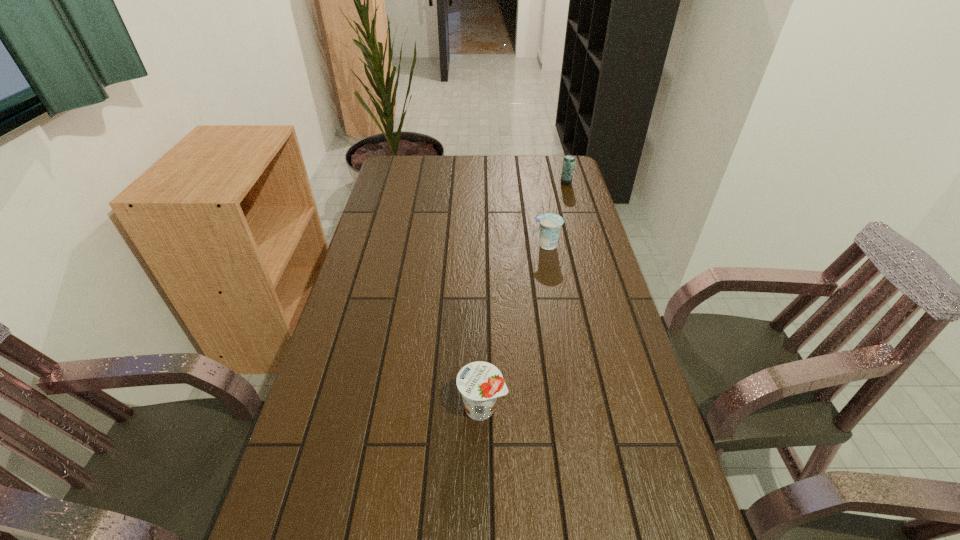
I want to click on vacant point that satisfies the following two spatial constraints: 1. on the back side of the left yogurt; 2. on the right side of the farthest object, so click(481, 183).

In order to click on vacant point that satisfies the following two spatial constraints: 1. on the back side of the right yogurt; 2. on the left side of the farthest object in this screenshot , I will do `click(535, 183)`.